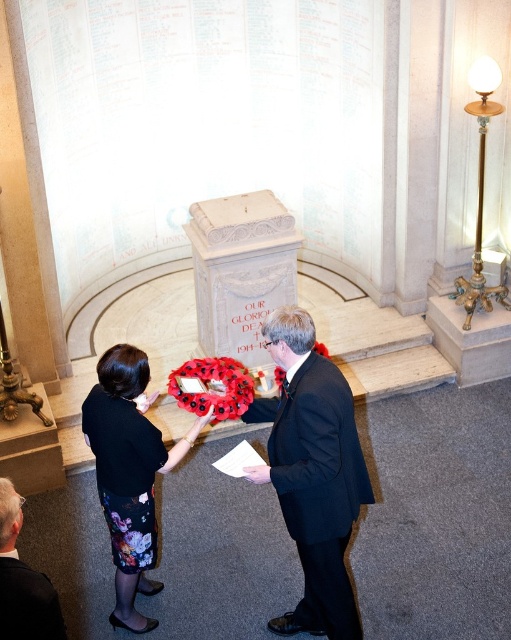
You are attending a formal ceremony and notice two people at the center of the scene. Which individual is positioned closer to you, the person in the black suit at center or the one in the floral skirt at center?

The black suit at center is closer to the viewer than the floral skirt at center, so the person in the black suit at center is positioned closer to you.

You are attending a formal ceremony and notice two people in the scene. One is wearing a floral skirt at center and the other is in a dark suit at lower left. From your perspective, which person is positioned higher in the image?

The floral skirt at center is located above the dark suit at lower left, so the person in the floral skirt at center is positioned higher in the image.